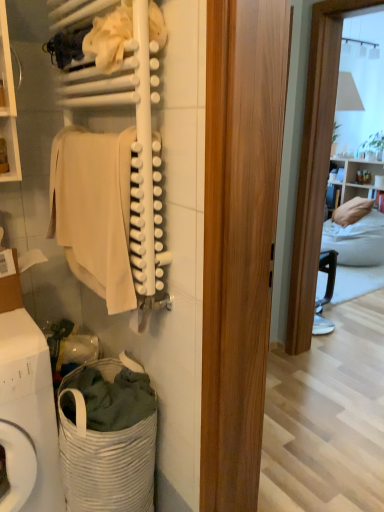
Question: Should I look upward or downward to see white woven laundry basket at lower left?

Choices:
 (A) up
 (B) down

Answer: (B)

Question: Would you say white woven laundry basket at lower left is a long distance from beige cotton towel at left?

Choices:
 (A) no
 (B) yes

Answer: (A)

Question: Is white woven laundry basket at lower left surrounding beige cotton towel at left?

Choices:
 (A) no
 (B) yes

Answer: (A)

Question: Is white woven laundry basket at lower left oriented towards beige cotton towel at left?

Choices:
 (A) yes
 (B) no

Answer: (B)

Question: Is white woven laundry basket at lower left thinner than beige cotton towel at left?

Choices:
 (A) yes
 (B) no

Answer: (B)

Question: From a real-world perspective, does white woven laundry basket at lower left sit lower than beige cotton towel at left?

Choices:
 (A) yes
 (B) no

Answer: (A)

Question: Is white woven laundry basket at lower left looking in the opposite direction of beige cotton towel at left?

Choices:
 (A) yes
 (B) no

Answer: (B)

Question: Is white woven laundry basket at lower left positioned with its back to beige cotton towel at left?

Choices:
 (A) yes
 (B) no

Answer: (B)

Question: Considering the relative sizes of white woven laundry basket at lower left and beige cotton towel at left in the image provided, is white woven laundry basket at lower left thinner than beige cotton towel at left?

Choices:
 (A) yes
 (B) no

Answer: (B)

Question: Is white woven laundry basket at lower left not within beige cotton towel at left?

Choices:
 (A) yes
 (B) no

Answer: (A)

Question: Considering the relative sizes of white woven laundry basket at lower left and beige cotton towel at left in the image provided, is white woven laundry basket at lower left bigger than beige cotton towel at left?

Choices:
 (A) yes
 (B) no

Answer: (A)

Question: Is white woven laundry basket at lower left far from beige cotton towel at left?

Choices:
 (A) yes
 (B) no

Answer: (B)

Question: Can you see white woven laundry basket at lower left touching beige cotton towel at left?

Choices:
 (A) no
 (B) yes

Answer: (A)

Question: Can you confirm if white matte towel at upper left is thinner than white woven laundry basket at lower left?

Choices:
 (A) yes
 (B) no

Answer: (A)